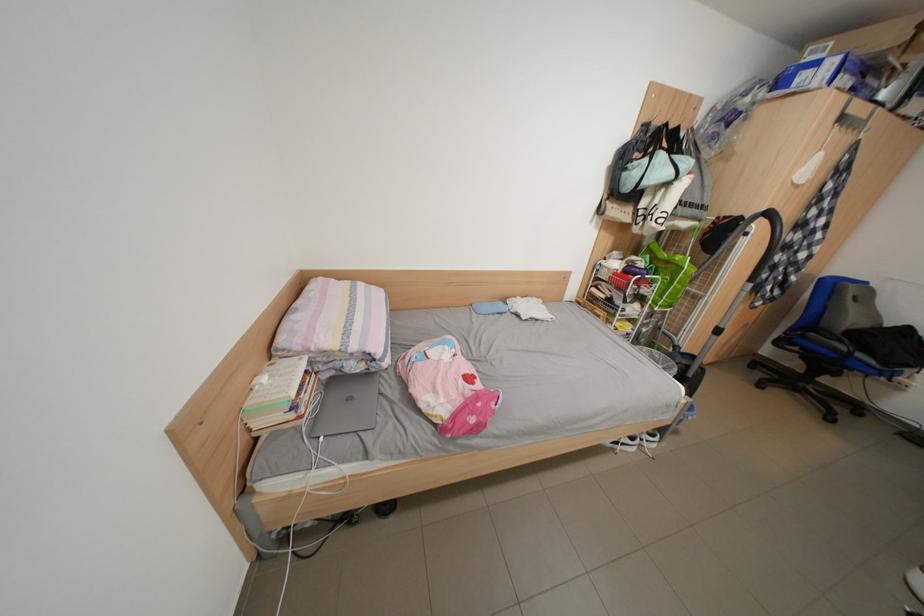
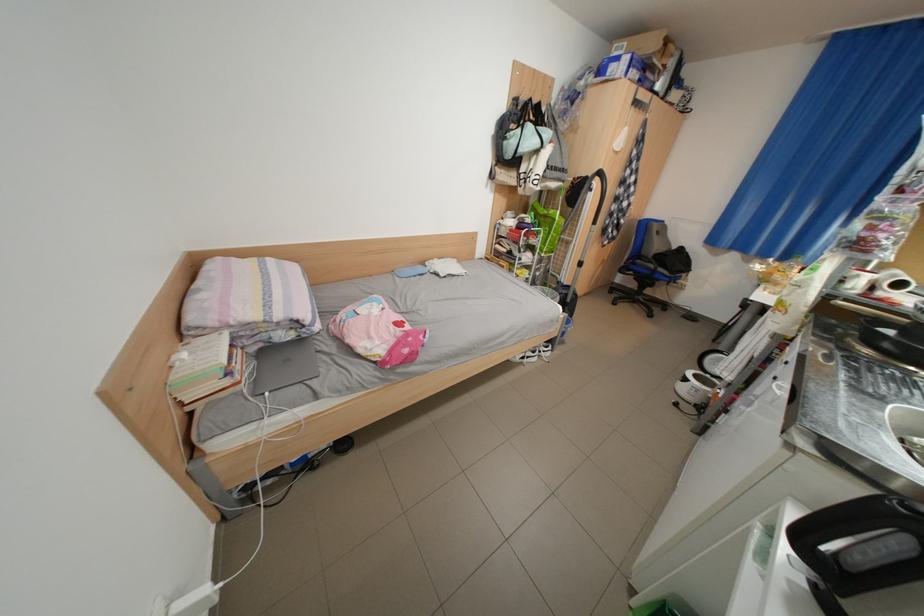
Where in the second image is the point corresponding to the point at 679,355 from the first image?

(565, 291)